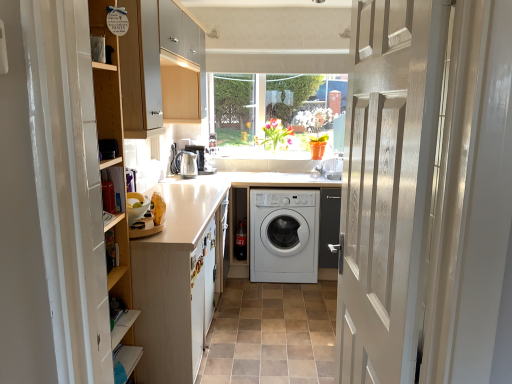
Question: Would you consider satin silver kettle at center to be distant from white matte washing machine at center?

Choices:
 (A) no
 (B) yes

Answer: (A)

Question: Is satin silver kettle at center in contact with white matte washing machine at center?

Choices:
 (A) no
 (B) yes

Answer: (A)

Question: Can you confirm if satin silver kettle at center is bigger than white matte washing machine at center?

Choices:
 (A) no
 (B) yes

Answer: (A)

Question: Considering the relative sizes of satin silver kettle at center and white matte washing machine at center in the image provided, is satin silver kettle at center thinner than white matte washing machine at center?

Choices:
 (A) no
 (B) yes

Answer: (B)

Question: Is satin silver kettle at center at the left side of white matte washing machine at center?

Choices:
 (A) no
 (B) yes

Answer: (B)

Question: Is satin silver kettle at center closer to the viewer compared to white matte washing machine at center?

Choices:
 (A) no
 (B) yes

Answer: (A)

Question: Does white wood door at center have a lesser height compared to satin silver kettle at center?

Choices:
 (A) no
 (B) yes

Answer: (A)

Question: Could you tell me if white wood door at center is facing satin silver kettle at center?

Choices:
 (A) yes
 (B) no

Answer: (B)

Question: Considering the relative positions of white wood door at center and satin silver kettle at center in the image provided, is white wood door at center to the left of satin silver kettle at center from the viewer's perspective?

Choices:
 (A) yes
 (B) no

Answer: (B)

Question: Is white wood door at center located outside satin silver kettle at center?

Choices:
 (A) yes
 (B) no

Answer: (A)

Question: Would you say white wood door at center is a long distance from satin silver kettle at center?

Choices:
 (A) no
 (B) yes

Answer: (B)

Question: Is white wood door at center surrounding satin silver kettle at center?

Choices:
 (A) yes
 (B) no

Answer: (B)

Question: Does white matte washing machine at center have a smaller size compared to white matte washer at center?

Choices:
 (A) no
 (B) yes

Answer: (A)